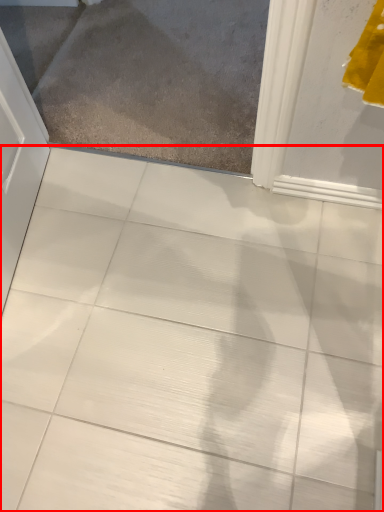
Question: Observing the image, what is the correct spatial positioning of ceramic tile (annotated by the red box) in reference to glass door?

Choices:
 (A) right
 (B) left

Answer: (B)